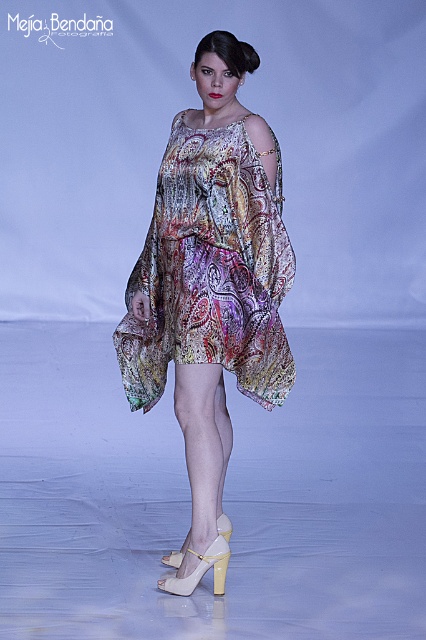
You are a photographer at the fashion show and need to focus your camera on the multicolored sheer dress at center and the white leather sandal at center. Which object should you adjust the focus to capture first if you want to prioritize the taller one?

The multicolored sheer dress at center is taller than the white leather sandal at center, so you should adjust the focus to capture the multicolored sheer dress at center first.